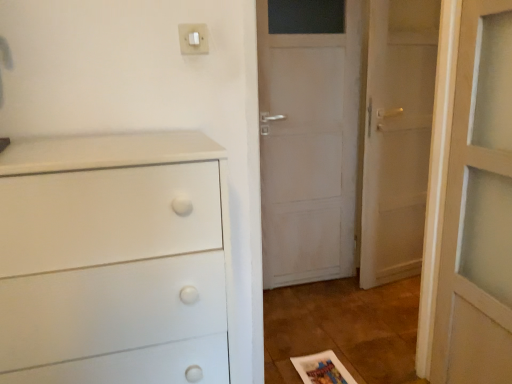
Question: Does white plastic light switch at upper center come behind white wooden door at right?

Choices:
 (A) no
 (B) yes

Answer: (A)

Question: Can you confirm if white plastic light switch at upper center is shorter than white wooden door at right?

Choices:
 (A) yes
 (B) no

Answer: (A)

Question: Is white plastic light switch at upper center thinner than white wooden door at right?

Choices:
 (A) no
 (B) yes

Answer: (B)

Question: Would you consider white plastic light switch at upper center to be distant from white wooden door at right?

Choices:
 (A) yes
 (B) no

Answer: (A)

Question: Is white plastic light switch at upper center wider than white wooden door at right?

Choices:
 (A) no
 (B) yes

Answer: (A)

Question: Can you confirm if white plastic light switch at upper center is smaller than white wooden door at right?

Choices:
 (A) yes
 (B) no

Answer: (A)

Question: Could you tell me if white matte chest of drawers at left is facing white wooden door at right?

Choices:
 (A) yes
 (B) no

Answer: (B)

Question: Does white matte chest of drawers at left contain white wooden door at right?

Choices:
 (A) yes
 (B) no

Answer: (B)

Question: From a real-world perspective, is white matte chest of drawers at left located beneath white wooden door at right?

Choices:
 (A) yes
 (B) no

Answer: (A)

Question: Can you confirm if white matte chest of drawers at left is smaller than white wooden door at right?

Choices:
 (A) yes
 (B) no

Answer: (B)

Question: From the image's perspective, is white matte chest of drawers at left under white wooden door at right?

Choices:
 (A) yes
 (B) no

Answer: (A)

Question: Is white matte chest of drawers at left thinner than white wooden door at right?

Choices:
 (A) yes
 (B) no

Answer: (B)

Question: Is white plastic light switch at upper center positioned behind white matte chest of drawers at left?

Choices:
 (A) no
 (B) yes

Answer: (B)